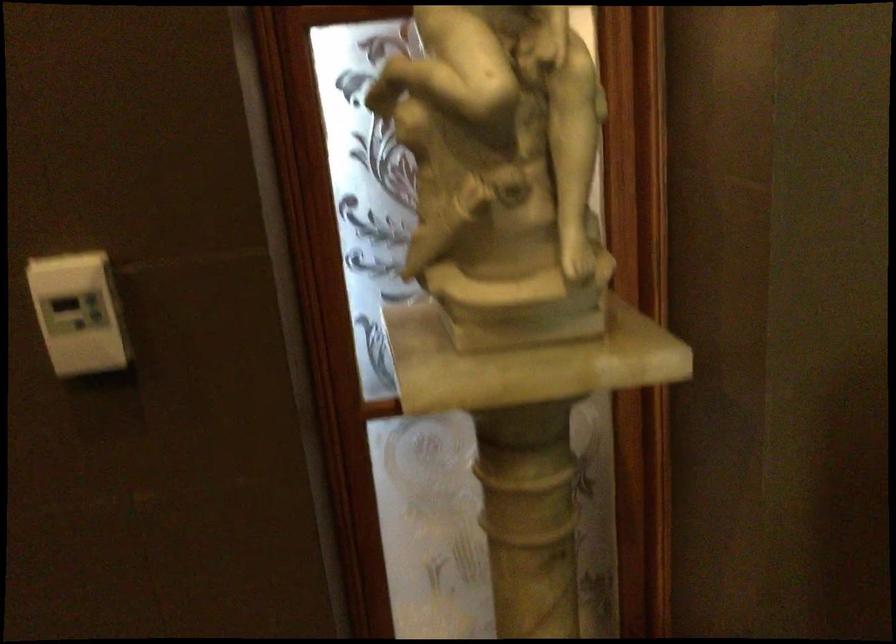
The location [79,313] corresponds to which object?

This point indicates the white control panel.